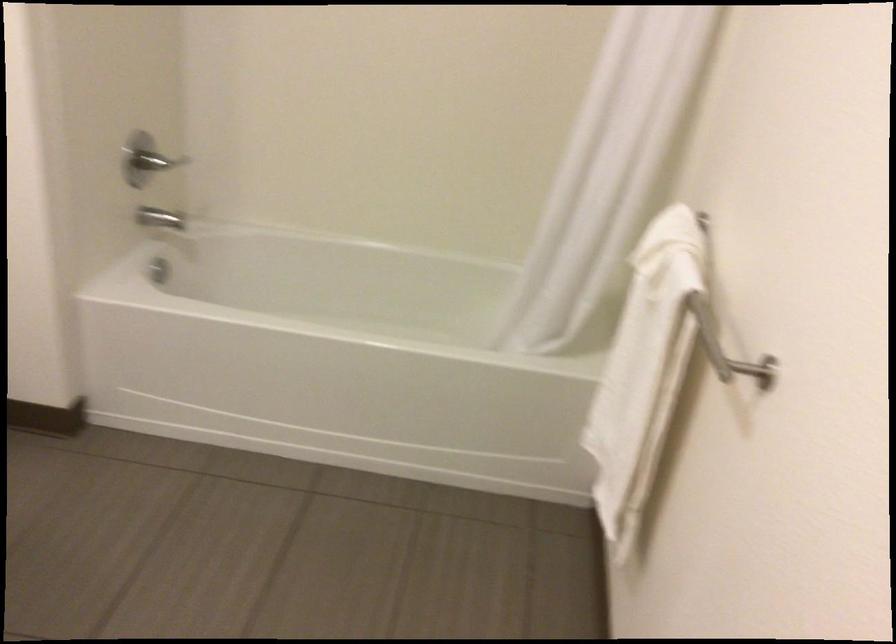
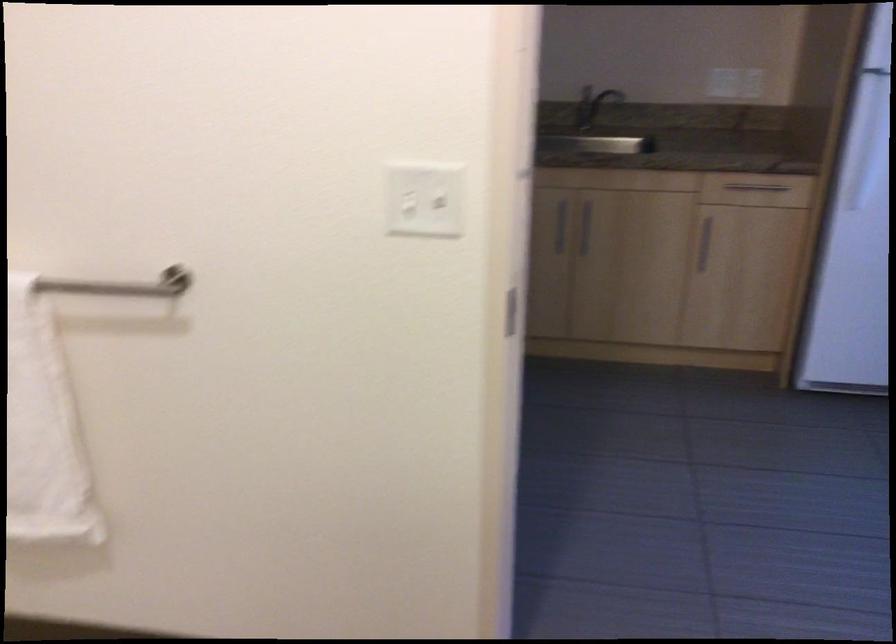
Based on the continuous images, in which direction is the camera rotating?

The camera's rotation is toward right-down.